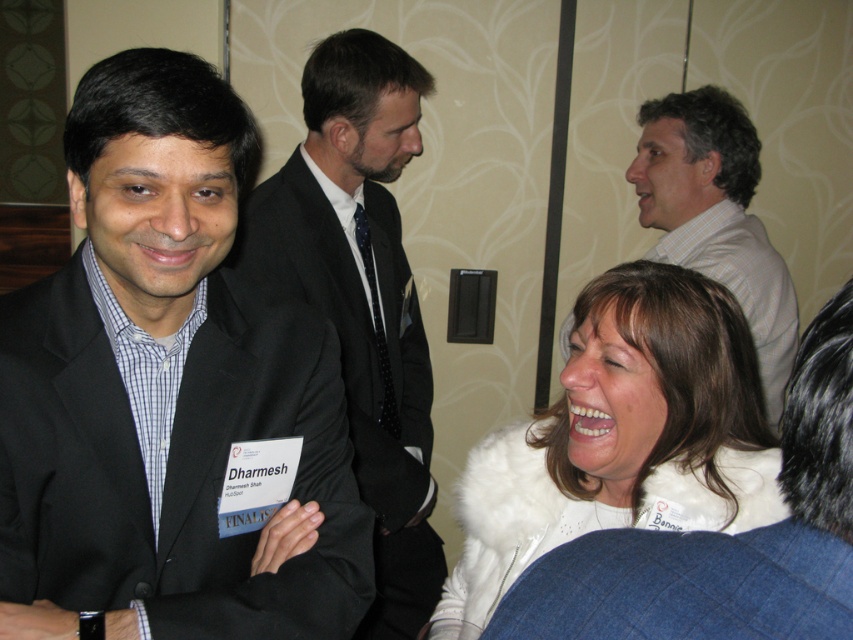
Does black matte suit at left appear on the left side of dark gray suit at center?

Indeed, black matte suit at left is positioned on the left side of dark gray suit at center.

The image size is (853, 640). I want to click on black matte suit at left, so click(163, 388).

Does black matte suit at left lie in front of white fur coat at lower right?

Yes.

Which is behind, point (198, 84) or point (677, 314)?

The point (677, 314) is behind.

Locate an element on the screen. The width and height of the screenshot is (853, 640). black matte suit at left is located at coordinates (163, 388).

The height and width of the screenshot is (640, 853). In order to click on black matte suit at left in this screenshot , I will do `click(163, 388)`.

Is point (573, 381) positioned in front of point (360, 195)?

Yes, it is.

Is point (515, 564) farther from camera compared to point (283, 257)?

No, it is not.

Does point (582, 476) lie in front of point (405, 140)?

Yes, point (582, 476) is in front of point (405, 140).

Locate an element on the screen. The width and height of the screenshot is (853, 640). white fur coat at lower right is located at coordinates (618, 429).